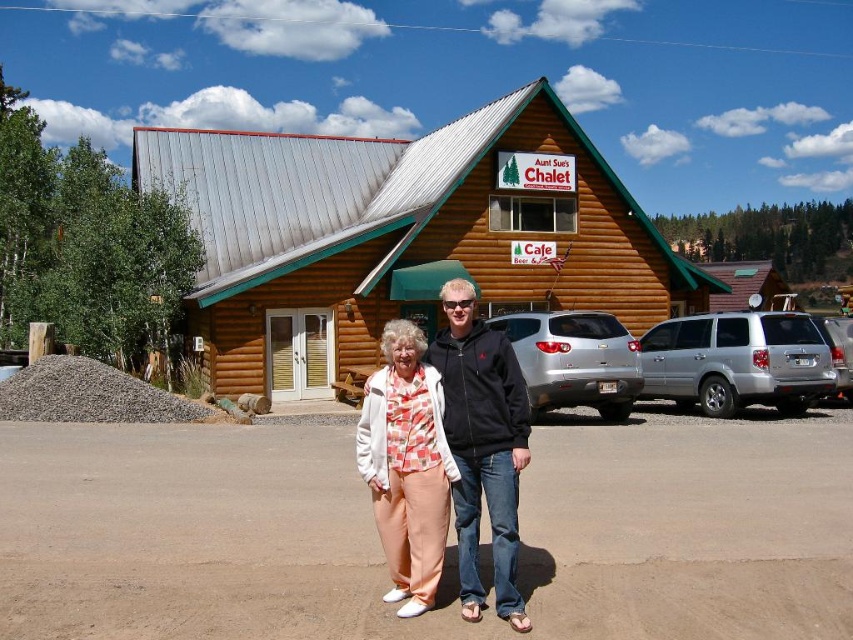
Between point (389, 212) and point (817, 324), which one is positioned behind?

Positioned behind is point (389, 212).

Which is more to the right, brown log cabin at center or silver metallic sedan at right?

Positioned to the right is silver metallic sedan at right.

The width and height of the screenshot is (853, 640). What are the coordinates of `brown log cabin at center` in the screenshot? It's located at (399, 236).

Does brown log cabin at center have a lesser height compared to brown wooden cabin at center?

Incorrect, brown log cabin at center's height does not fall short of brown wooden cabin at center's.

Does brown log cabin at center have a greater width compared to brown wooden cabin at center?

No.

Looking at this image, who is more forward, (x=471, y=209) or (x=741, y=305)?

Point (x=471, y=209) is in front.

This screenshot has width=853, height=640. Find the location of `brown log cabin at center`. brown log cabin at center is located at coordinates (399, 236).

Does brown log cabin at center have a greater height compared to silver metallic suv at right?

Yes.

Describe the element at coordinates (399, 236) in the screenshot. I see `brown log cabin at center` at that location.

Identify the location of brown log cabin at center. (399, 236).